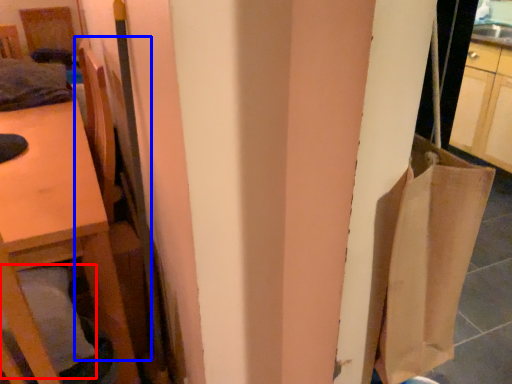
Question: Which point is further to the camera, pillow (highlighted by a red box) or chair (highlighted by a blue box)?

Choices:
 (A) pillow
 (B) chair

Answer: (B)